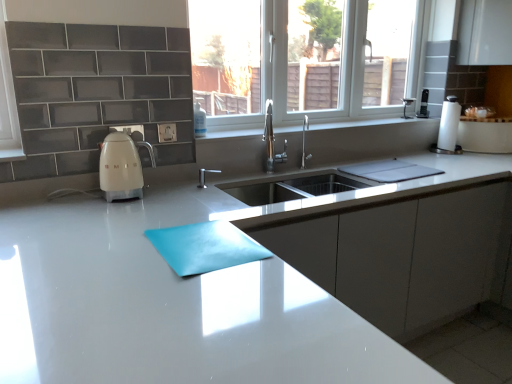
Identify the location of free space to the left of white glossy kettle at left. pyautogui.click(x=73, y=194).